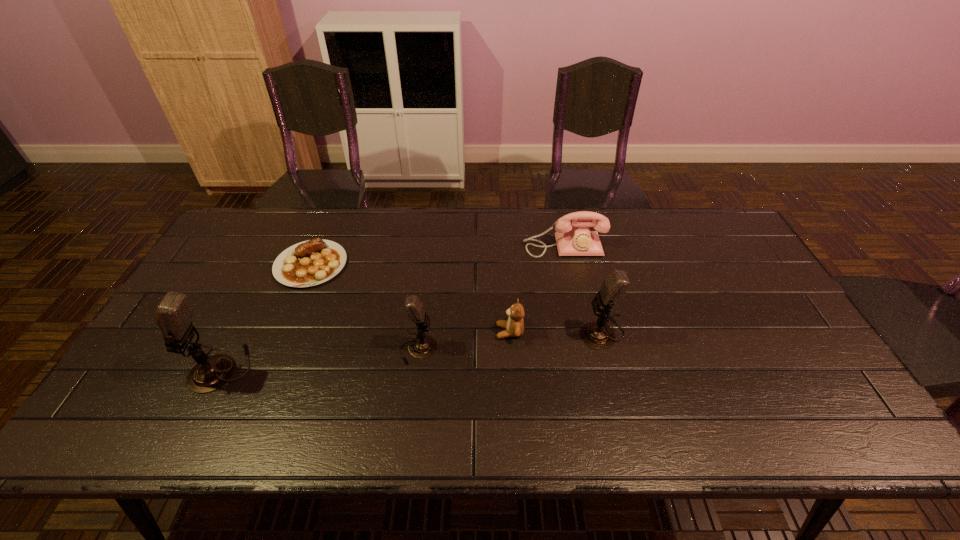
The height and width of the screenshot is (540, 960). I want to click on free spot between the shortest microphone and the teddy bear, so click(464, 341).

In order to click on vacant area that lies between the tallest microphone and the third object from left to right in this screenshot , I will do `click(320, 359)`.

The width and height of the screenshot is (960, 540). Find the location of `object that is the fifth closest one to the fourth tallest object`. object that is the fifth closest one to the fourth tallest object is located at coordinates (174, 314).

In order to click on object that stands as the second closest to the tallest microphone in this screenshot , I will do `click(422, 346)`.

Identify which microphone is the second nearest to the tallest object. Please provide its 2D coordinates. Your answer should be formatted as a tuple, i.e. [(x, y)], where the tuple contains the x and y coordinates of a point satisfying the conditions above.

[(598, 335)]

Point out which microphone is positioned as the second nearest to the second microphone from left to right. Please provide its 2D coordinates. Your answer should be formatted as a tuple, i.e. [(x, y)], where the tuple contains the x and y coordinates of a point satisfying the conditions above.

[(598, 335)]

You are a GUI agent. You are given a task and a screenshot of the screen. Output one action in this format:
    pyautogui.click(x=<x>, y=<y>)
    Task: Click on the vacant region that satisfies the following two spatial constraints: 1. on the dial of the telephone; 2. on the front-facing side of the shortest microphone
    Image resolution: width=960 pixels, height=540 pixels.
    Given the screenshot: What is the action you would take?
    pyautogui.click(x=587, y=349)

Identify the location of vacant area in the image that satisfies the following two spatial constraints: 1. on the dial of the telephone; 2. on the front-facing side of the tallest object. (590, 369).